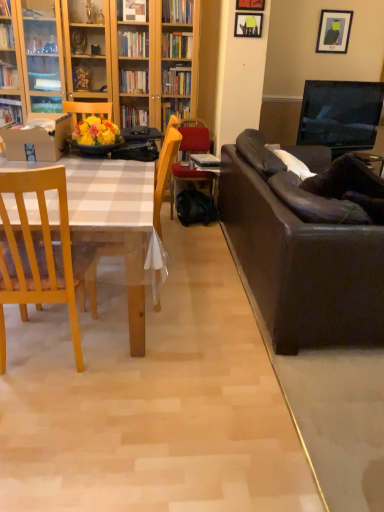
Question: Is wooden chair at center, the second chair from the back, at the right side of velvet red armchair at center?

Choices:
 (A) no
 (B) yes

Answer: (A)

Question: Is wooden chair at center, the second chair from the back, taller than velvet red armchair at center?

Choices:
 (A) yes
 (B) no

Answer: (A)

Question: Is wooden chair at center, the second chair from the back, completely or partially outside of velvet red armchair at center?

Choices:
 (A) yes
 (B) no

Answer: (A)

Question: Would you say wooden chair at center, the second chair from the back, is a long distance from velvet red armchair at center?

Choices:
 (A) yes
 (B) no

Answer: (A)

Question: Is wooden chair at center, arranged as the 2th chair when viewed from the front, in contact with velvet red armchair at center?

Choices:
 (A) yes
 (B) no

Answer: (B)

Question: Is wooden chair at center, arranged as the 2th chair when viewed from the front, wider than velvet red armchair at center?

Choices:
 (A) no
 (B) yes

Answer: (A)

Question: Considering the relative positions of matte black picture frame at upper right, placed as the first picture frame when sorted from right to left, and wooden chair at center, positioned as the first chair in back-to-front order, in the image provided, is matte black picture frame at upper right, placed as the first picture frame when sorted from right to left, to the right of wooden chair at center, positioned as the first chair in back-to-front order, from the viewer's perspective?

Choices:
 (A) no
 (B) yes

Answer: (B)

Question: Is matte black picture frame at upper right, which is the 1th picture frame in back-to-front order, positioned beyond the bounds of wooden chair at center, positioned as the first chair in back-to-front order?

Choices:
 (A) yes
 (B) no

Answer: (A)

Question: Considering the relative positions of matte black picture frame at upper right, the third picture frame positioned from the front, and wooden chair at center, the 3th chair when ordered from front to back, in the image provided, is matte black picture frame at upper right, the third picture frame positioned from the front, to the left of wooden chair at center, the 3th chair when ordered from front to back, from the viewer's perspective?

Choices:
 (A) no
 (B) yes

Answer: (A)

Question: Can you confirm if matte black picture frame at upper right, placed as the first picture frame when sorted from right to left, is shorter than wooden chair at center, positioned as the first chair in back-to-front order?

Choices:
 (A) yes
 (B) no

Answer: (B)

Question: Is matte black picture frame at upper right, the third picture frame positioned from the front, placed right next to wooden chair at center, positioned as the first chair in back-to-front order?

Choices:
 (A) yes
 (B) no

Answer: (B)

Question: Is matte black picture frame at upper right, placed as the first picture frame when sorted from right to left, aimed at wooden chair at center, positioned as the first chair in back-to-front order?

Choices:
 (A) yes
 (B) no

Answer: (B)

Question: Considering the relative sizes of wooden chair at center, the 3th chair when ordered from front to back, and matte black picture frame at upper center, the second picture frame in the front-to-back sequence, in the image provided, is wooden chair at center, the 3th chair when ordered from front to back, smaller than matte black picture frame at upper center, the second picture frame in the front-to-back sequence,?

Choices:
 (A) yes
 (B) no

Answer: (B)